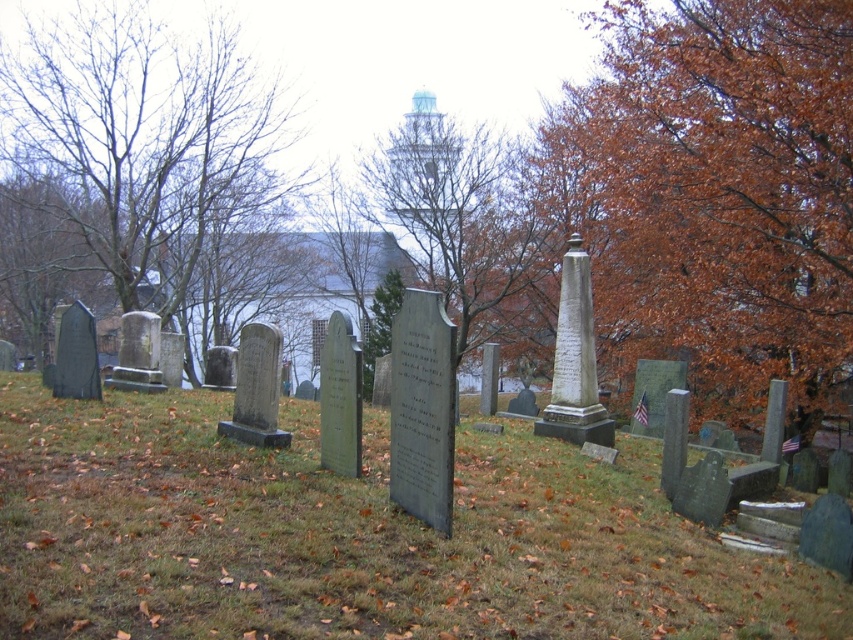
Looking at this image, you are standing in the cemetery and want to take a photo of the brown leafy tree at center right and the bare branches at left. Which object is closer to the camera?

The brown leafy tree at center right is positioned over the bare branches at left, so it is closer to the camera.

Looking at this image, you are standing at the entrance of the cemetery and want to find the brown leafy tree at center right. According to the coordinates provided, in which direction should you walk from your current position to locate it?

The brown leafy tree at center right is located at coordinates point (717, 193). Since you are at the entrance, which is likely at the lower edge of the image, you should walk towards the center right area of the cemetery to reach it.

You are standing in the cemetery and want to take a photo of the green grass at center and the brown leafy tree at center. Which one should you focus on first to ensure both are in clear view?

You should focus on the green grass at center first because it is closer to the viewer than the brown leafy tree at center, allowing both to be in focus when using a camera with depth of field.